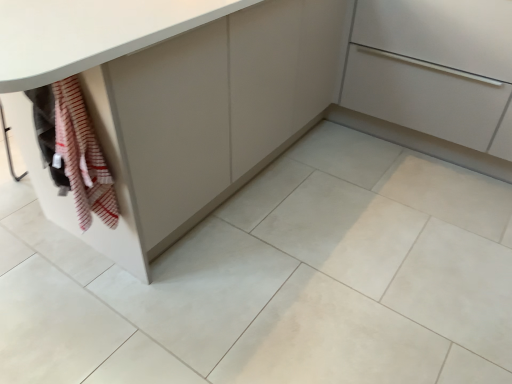
Question: Choose the correct answer: Is matte white cabinet at center, the 2th cabinetry viewed from the left, inside striped cotton towel at lower left or outside it?

Choices:
 (A) outside
 (B) inside

Answer: (A)

Question: Based on their sizes in the image, would you say matte white cabinet at center, placed as the first cabinetry when sorted from right to left, is bigger or smaller than striped cotton towel at lower left?

Choices:
 (A) big
 (B) small

Answer: (A)

Question: Based on their relative distances, which object is farther from the striped cotton towel at lower left?

Choices:
 (A) white glossy tile at lower left
 (B) matte white cabinet at center, placed as the first cabinetry when sorted from right to left
 (C) matte gray cabinet at lower left, acting as the second cabinetry starting from the right

Answer: (B)

Question: Estimate the real-world distances between objects in this image. Which object is closer to the white glossy tile at lower left?

Choices:
 (A) striped cotton towel at lower left
 (B) matte white cabinet at center, the 2th cabinetry viewed from the left
 (C) matte gray cabinet at lower left, acting as the second cabinetry starting from the right

Answer: (A)